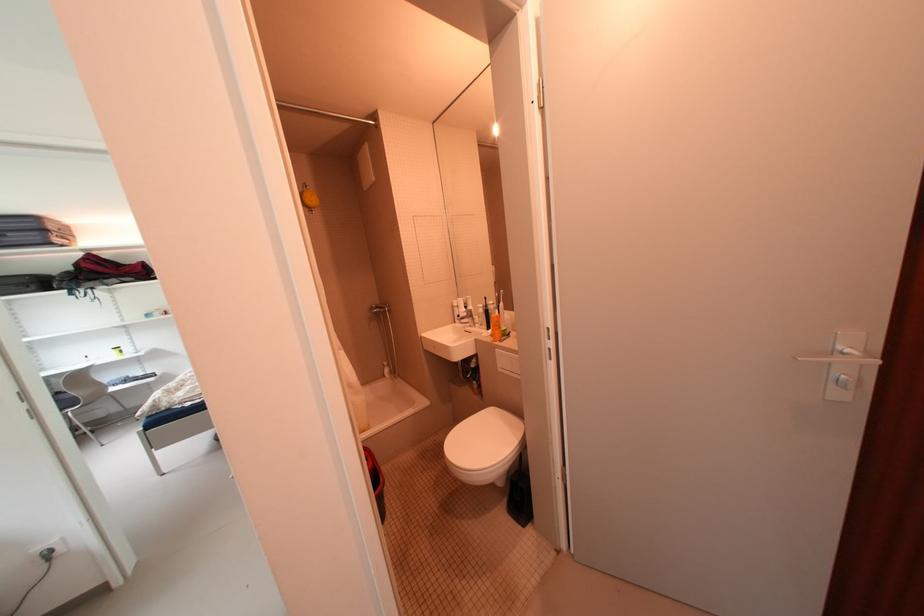
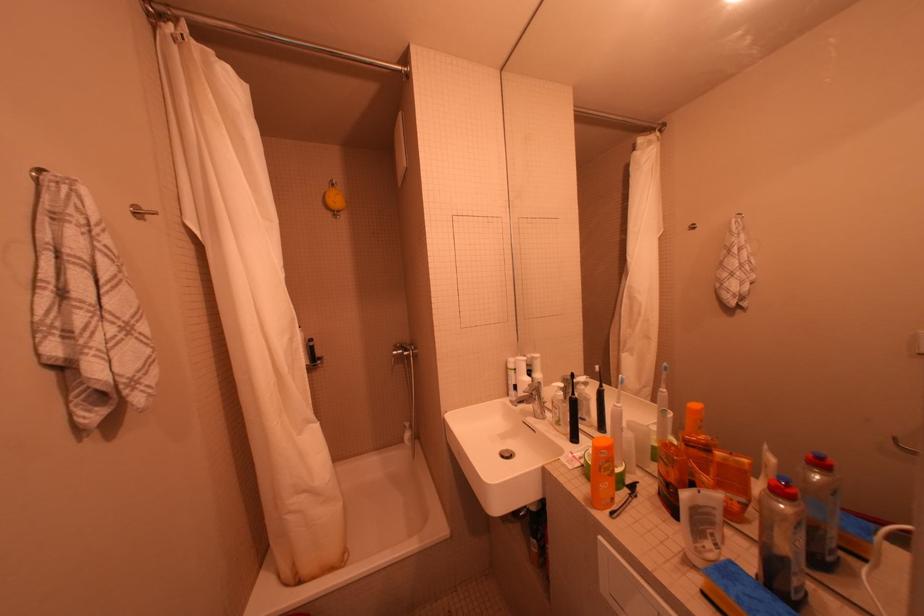
Question: The camera is either moving clockwise (left) or counter-clockwise (right) around the object. The first image is from the beginning of the video and the second image is from the end. Is the camera moving left or right when shooting the video?

Choices:
 (A) Left
 (B) Right

Answer: (B)